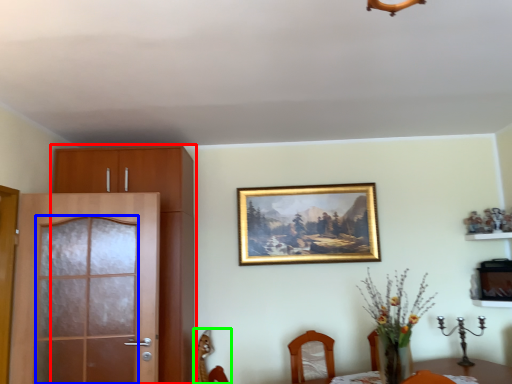
Question: Which object is positioned closest to cabinetry (highlighted by a red box)? Select from screen door (highlighted by a blue box) and chair (highlighted by a green box).

Choices:
 (A) screen door
 (B) chair

Answer: (A)